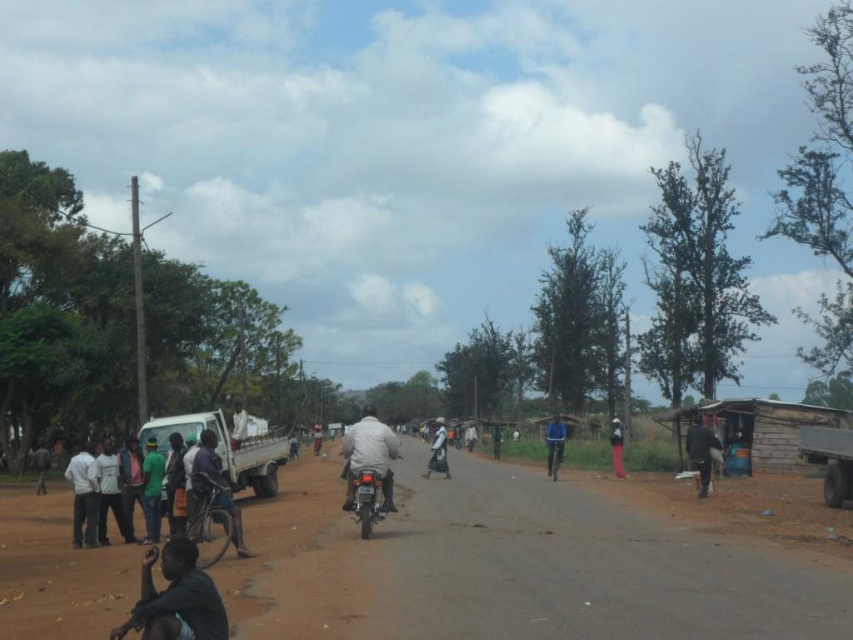
You are a delivery driver trying to navigate through the rural area shown in the image. You need to pass between the brown dirt track at lower left and the green matte shirt at left. Can you estimate if there is enough space for your vehicle, which is 2 meters wide?

The brown dirt track at lower left might be wider than the green matte shirt at left, but since the exact width isn

You are a photographer standing at the camera position. You want to take a photo of the white fabric motorcyclist at center. If your camera has a maximum focus range of 100 feet, will you be able to capture the motorcyclist clearly?

The white fabric motorcyclist at center is 98.16 feet away from the camera. Since this distance is within the camera maximum focus range of 100 feet, the photographer can capture the motorcyclist clearly.

Looking at this image, you are standing at the point marked by coordinates point (213, 490) in the image. Looking forward, you see a rural road scene with a white pickup truck on the left and a makeshift stall on the right. Which direction should you turn to face the white pickup truck?

The point (213, 490) marks dark skin person at center. Since the white pickup truck is on the left side of the road, you should turn to your left to face the white pickup truck.